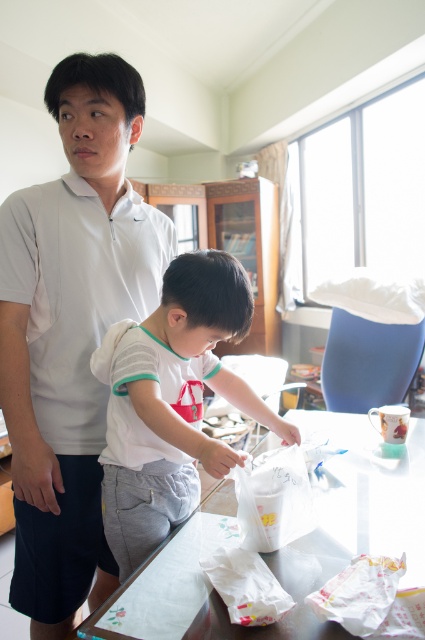
You are designing a new clothing line and need to choose between two materials for a summer shirt. The white matte shirt at upper left and the transparent plastic table at center are examples of materials you saw in the image. Which material is more suitable for a summer shirt based on their thickness?

The white matte shirt at upper left is thinner than the transparent plastic table at center, so the white matte shirt at upper left material is more suitable for a summer shirt as it is thinner and more breathable.

You are standing in the living room and want to pick up the item closest to you. Which point should you reach for, point (96, 449) or point (226, 451)?

Point (96, 449) is closer to you than point (226, 451), so you should reach for point (96, 449).

You are organizing a closet and have two shirts to hang. The white matte shirt at upper left and the white cotton shirt at center. Which shirt should you choose if you want to save more space?

The white matte shirt at upper left is thinner than the white cotton shirt at center, so choosing the white matte shirt at upper left will save more space when hanging.